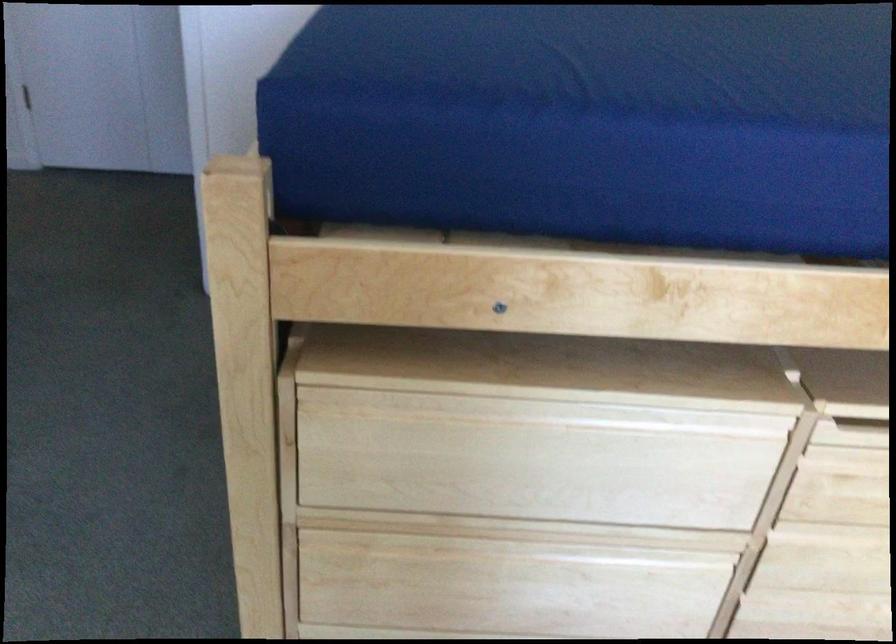
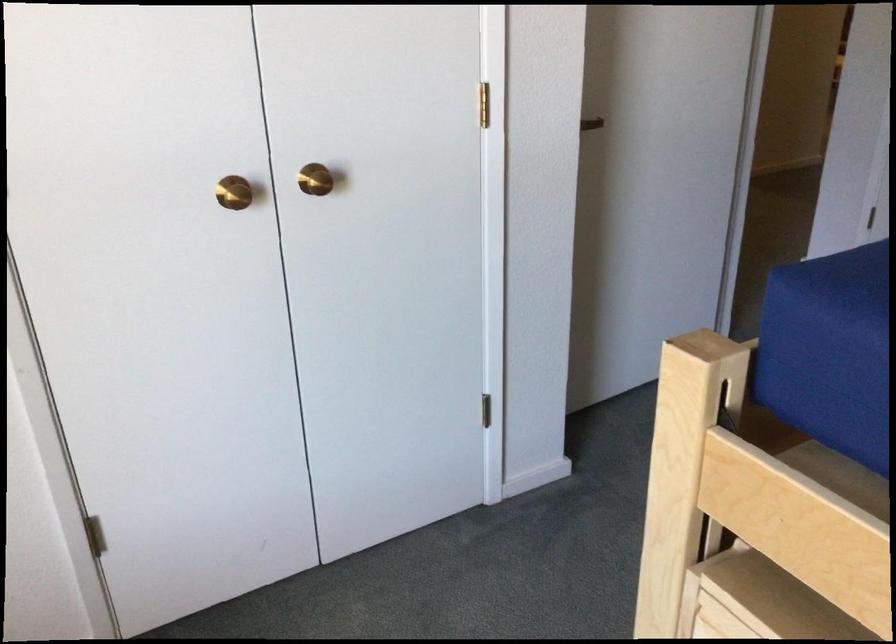
Question: Based on the continuous images, in which direction is the camera rotating? Reply with the corresponding letter.

Choices:
 (A) Left
 (B) Right
 (C) Up
 (D) Down

Answer: (A)